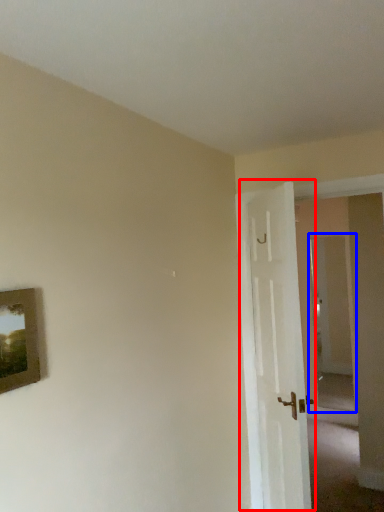
Question: Among these objects, which one is farthest to the camera, door (highlighted by a red box) or glass door (highlighted by a blue box)?

Choices:
 (A) door
 (B) glass door

Answer: (B)